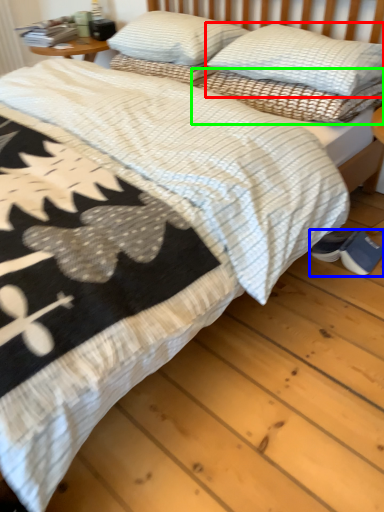
Question: Considering the real-world distances, which object is farthest from pillow (highlighted by a red box)? footwear (highlighted by a blue box) or pillow (highlighted by a green box)?

Choices:
 (A) footwear
 (B) pillow

Answer: (A)